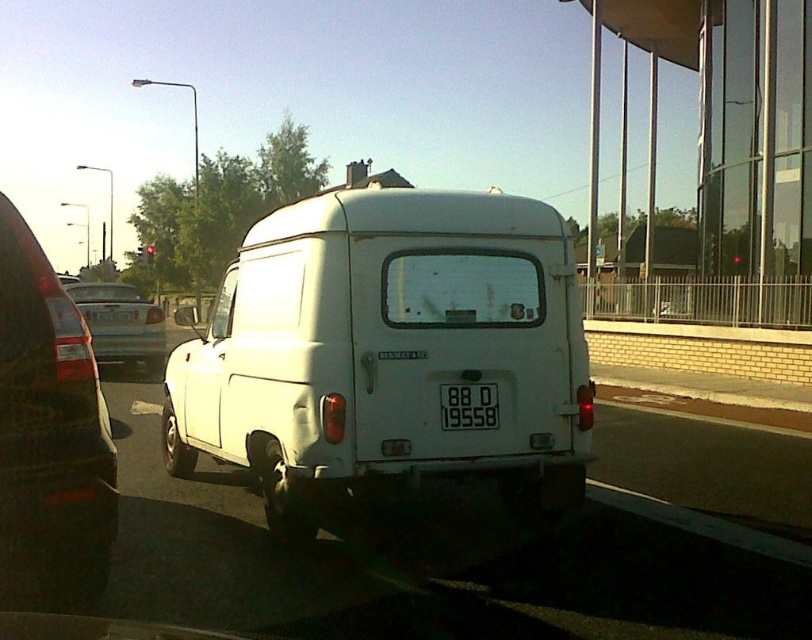
You are a delivery driver who needs to confirm the vehicle details before proceeding. Given the scene described, which object is bigger in size between the matte black van at left and the black plastic license plate at center?

The matte black van at left has a larger size compared to the black plastic license plate at center, so the matte black van at left is bigger.

You are standing in front of the white van and want to place a sticker on the point closer to you between point (37, 428) and point (102, 296). Which point should you choose?

You should choose point (37, 428) because it is closer to the viewer than point (102, 296).

You are a delivery driver who needs to attach a GPS tracker to the matte black van at left. The GPS tracker must be placed exactly 8 feet away from the black plastic license plate at center. Can you place it on the van? Explain why or why not based on the distance between them.

The distance between the matte black van at left and the black plastic license plate at center is 7.23 feet. Since the required distance for placing the GPS tracker is 8 feet away from the license plate, it is not possible to place it on the van because the van is closer than the required distance.